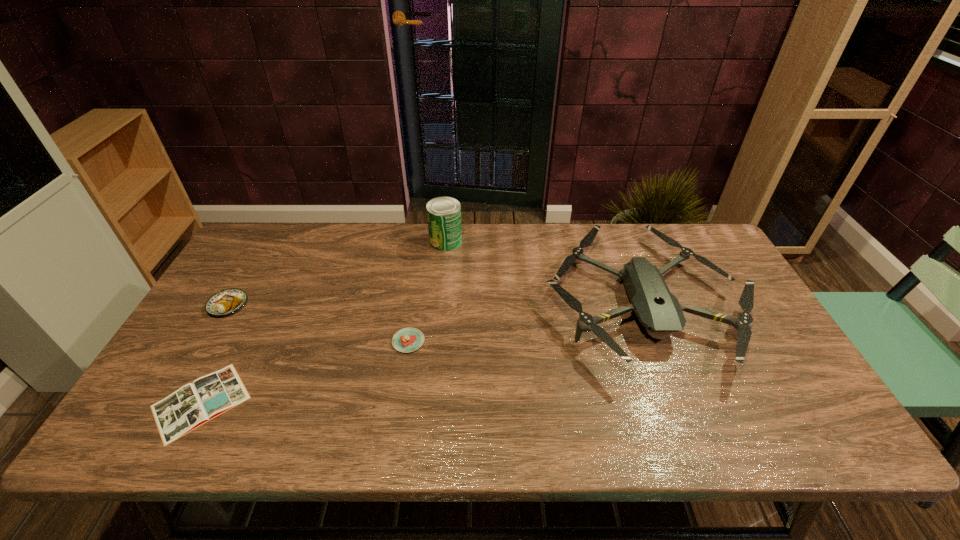
Find the location of a particular element. vacant position located 0.180m on the front of the taller pastry is located at coordinates (188, 373).

This screenshot has height=540, width=960. Find the location of `vacant space located 0.230m on the front of the nearer pastry`. vacant space located 0.230m on the front of the nearer pastry is located at coordinates (394, 438).

Find the location of a particular element. vacant space located on the back of the shortest object is located at coordinates (236, 336).

Identify the location of can at the far edge. The height and width of the screenshot is (540, 960). (443, 213).

This screenshot has width=960, height=540. What are the coordinates of `drone present at the far edge` in the screenshot? It's located at (658, 310).

Find the location of a particular element. object present at the near edge is located at coordinates [x=192, y=405].

Identify the location of pastry at the left edge. The height and width of the screenshot is (540, 960). (225, 302).

Where is `book positioned at the left edge`? Image resolution: width=960 pixels, height=540 pixels. book positioned at the left edge is located at coordinates (192, 405).

I want to click on object situated at the right edge, so click(x=658, y=310).

The image size is (960, 540). Identify the location of object that is at the near left corner. (192, 405).